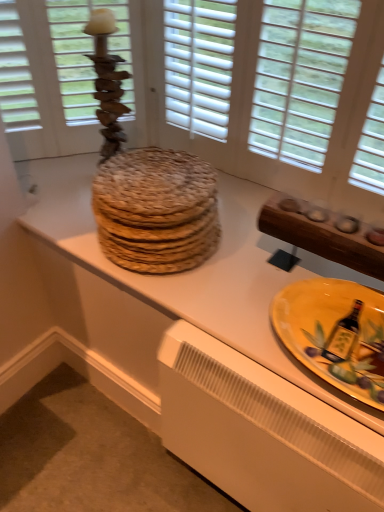
Find the location of a particular element. The height and width of the screenshot is (512, 384). white plastic radiator at lower center is located at coordinates (262, 431).

Considering the relative sizes of wooden textured platters at center and white plastic radiator at lower center in the image provided, is wooden textured platters at center taller than white plastic radiator at lower center?

In fact, wooden textured platters at center may be shorter than white plastic radiator at lower center.

Is point (124, 311) closer or farther from the camera than point (293, 418)?

Point (124, 311) is positioned farther from the camera compared to point (293, 418).

Considering the sizes of objects wooden textured platters at center and white plastic radiator at lower center in the image provided, who is wider, wooden textured platters at center or white plastic radiator at lower center?

wooden textured platters at center.

Is wooden candlestick at upper left oriented towards yellow glazed plate at lower right?

No, wooden candlestick at upper left is not facing towards yellow glazed plate at lower right.

Is wooden candlestick at upper left at the right side of yellow glazed plate at lower right?

Incorrect, wooden candlestick at upper left is not on the right side of yellow glazed plate at lower right.

Which is behind, wooden candlestick at upper left or yellow glazed plate at lower right?

wooden candlestick at upper left.

Are wooden candlestick at upper left and yellow glazed plate at lower right located far from each other?

No, there isn't a large distance between wooden candlestick at upper left and yellow glazed plate at lower right.

Who is smaller, white plastic radiator at lower center or yellow glazed plate at lower right?

Smaller between the two is yellow glazed plate at lower right.

Which is closer, [376,496] or [366,353]?

Point [376,496].

Between white plastic radiator at lower center and yellow glazed plate at lower right, which one has smaller width?

With smaller width is white plastic radiator at lower center.

From the image's perspective, between wooden candlestick at upper left and wooden textured platters at center, which one is located above?

wooden candlestick at upper left appears higher in the image.

Find the location of a particular element. window screen on the left side of wooden textured platters at center is located at coordinates (83, 52).

Based on the photo, does wooden candlestick at upper left touch wooden textured platters at center?

wooden candlestick at upper left and wooden textured platters at center are clearly separated.

Choose the correct answer: Is wooden candlestick at upper left inside wooden textured platters at center or outside it?

wooden candlestick at upper left is outside wooden textured platters at center.

From a real-world perspective, between yellow glazed plate at lower right and wooden candlestick at upper left, who is vertically lower?

In real-world perspective, yellow glazed plate at lower right is lower.

In terms of height, does yellow glazed plate at lower right look taller or shorter compared to wooden candlestick at upper left?

Considering their sizes, yellow glazed plate at lower right has less height than wooden candlestick at upper left.

Is point (317, 335) positioned after point (69, 46)?

No.

Which of these two, yellow glazed plate at lower right or wooden candlestick at upper left, is wider?

yellow glazed plate at lower right.

Is white plastic radiator at lower center inside the boundaries of wooden candlestick at upper left, or outside?

white plastic radiator at lower center is outside wooden candlestick at upper left.

Considering the points (361, 476) and (129, 66), which point is behind, point (361, 476) or point (129, 66)?

The point (129, 66) is farther from the camera.

Find the location of `radiator directly beneath the wooden candlestick at upper left (from a real-world perspective)`. radiator directly beneath the wooden candlestick at upper left (from a real-world perspective) is located at coordinates (262, 431).

From the image's perspective, is white plastic radiator at lower center under wooden candlestick at upper left?

Indeed, from the image's perspective, white plastic radiator at lower center is shown beneath wooden candlestick at upper left.

Can you confirm if yellow glazed plate at lower right is thinner than wooden textured platters at center?

Yes, yellow glazed plate at lower right is thinner than wooden textured platters at center.

Considering the relative positions of yellow glazed plate at lower right and wooden textured platters at center in the image provided, is yellow glazed plate at lower right to the left of wooden textured platters at center from the viewer's perspective?

No.

In terms of size, does yellow glazed plate at lower right appear bigger or smaller than wooden textured platters at center?

Clearly, yellow glazed plate at lower right is smaller in size than wooden textured platters at center.

In the image, there is a wooden textured platters at center. Find the location of `radiator below it (from a real-world perspective)`. radiator below it (from a real-world perspective) is located at coordinates (262, 431).

Find the location of a particular element. The image size is (384, 512). plate that appears below the wooden candlestick at upper left (from the image's perspective) is located at coordinates (335, 334).

When comparing their distances from yellow glazed plate at lower right, does wooden candlestick at upper left or wooden textured platters at center seem closer?

Based on the image, wooden textured platters at center appears to be nearer to yellow glazed plate at lower right.

When comparing their distances from wooden textured platters at center, does yellow glazed plate at lower right or wooden candlestick at upper left seem further?

Based on the image, wooden candlestick at upper left appears to be further to wooden textured platters at center.

Considering their positions, is wooden textured platters at center positioned further to wooden candlestick at upper left than yellow glazed plate at lower right?

yellow glazed plate at lower right.

Which object lies further to the anchor point wooden candlestick at upper left, yellow glazed plate at lower right or wooden textured platters at center?

Among the two, yellow glazed plate at lower right is located further to wooden candlestick at upper left.

Consider the image. Estimate the real-world distances between objects in this image. Which object is further from wooden textured platters at center, wooden candlestick at upper left or yellow glazed plate at lower right?

The object further to wooden textured platters at center is wooden candlestick at upper left.

Considering their positions, is yellow glazed plate at lower right positioned further to wooden candlestick at upper left than white plastic radiator at lower center?

Based on the image, white plastic radiator at lower center appears to be further to wooden candlestick at upper left.

Based on their spatial positions, is yellow glazed plate at lower right or wooden candlestick at upper left closer to white plastic radiator at lower center?

yellow glazed plate at lower right.

Estimate the real-world distances between objects in this image. Which object is further from white plastic radiator at lower center, wooden textured platters at center or yellow glazed plate at lower right?

yellow glazed plate at lower right is positioned further to the anchor white plastic radiator at lower center.

Find the location of a particular element. plate between wooden candlestick at upper left and white plastic radiator at lower center vertically is located at coordinates (335, 334).

Where is `counter top between wooden candlestick at upper left and yellow glazed plate at lower right in the up-down direction`? The image size is (384, 512). counter top between wooden candlestick at upper left and yellow glazed plate at lower right in the up-down direction is located at coordinates (216, 355).

You are a GUI agent. You are given a task and a screenshot of the screen. Output one action in this format:
    pyautogui.click(x=<x>, y=<y>)
    Task: Click on the plate that lies between wooden textured platters at center and white plastic radiator at lower center from top to bottom
    The height and width of the screenshot is (512, 384).
    Given the screenshot: What is the action you would take?
    pyautogui.click(x=335, y=334)

Locate an element on the screen. counter top between wooden candlestick at upper left and white plastic radiator at lower center from top to bottom is located at coordinates (216, 355).